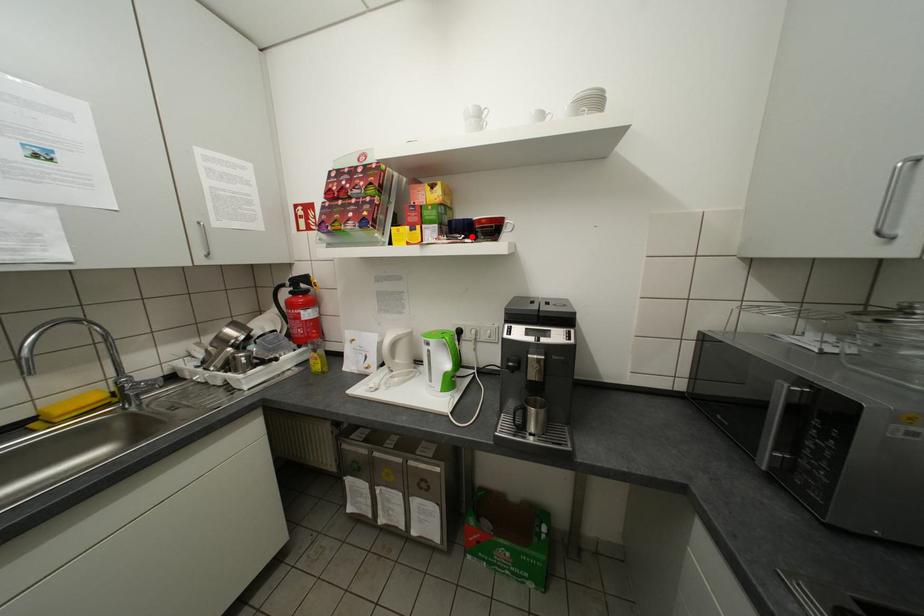
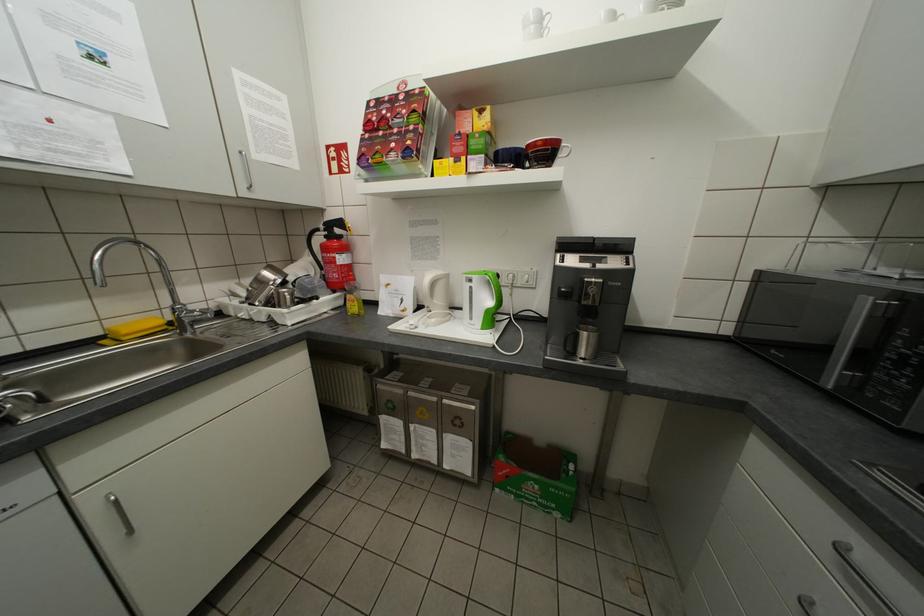
Where in the second image is the point corresponding to the highlighted location from the first image?

(521, 166)